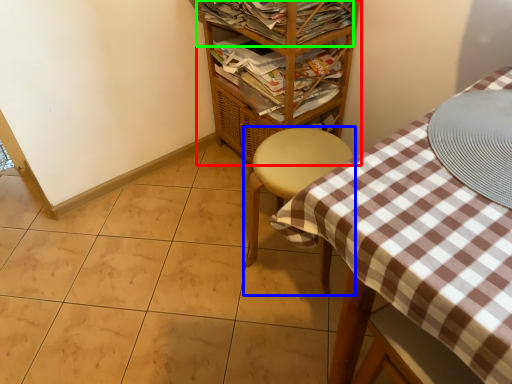
Question: Estimate the real-world distances between objects in this image. Which object is closer to shelf (highlighted by a red box), furniture (highlighted by a blue box) or magazine (highlighted by a green box)?

Choices:
 (A) furniture
 (B) magazine

Answer: (B)